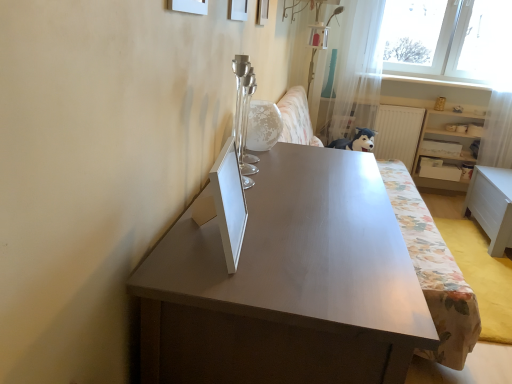
Locate an element on the screen. The image size is (512, 384). vacant space to the right of white glossy globe at center is located at coordinates tap(307, 152).